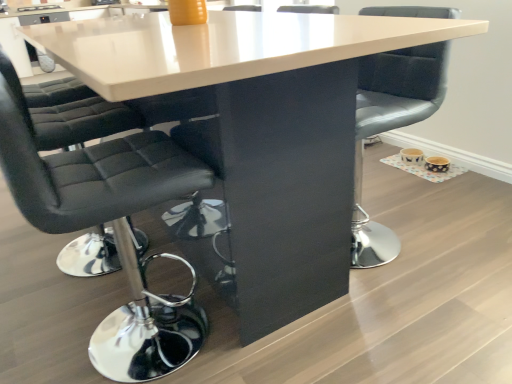
Question: In terms of size, does matte gray cushioned chair at center, which appears as the 1th chair when viewed from the right, appear bigger or smaller than black leather chair at left, positioned as the 2th chair in right-to-left order?

Choices:
 (A) big
 (B) small

Answer: (B)

Question: In the image, is matte gray cushioned chair at center, placed as the second chair when sorted from left to right, positioned in front of or behind black leather chair at left, positioned as the 2th chair in right-to-left order?

Choices:
 (A) behind
 (B) front

Answer: (A)

Question: Based on their positions, is matte gray cushioned chair at center, which appears as the 1th chair when viewed from the right, located to the left or right of black leather chair at left, positioned as the 2th chair in right-to-left order?

Choices:
 (A) right
 (B) left

Answer: (A)

Question: Considering their positions, is black leather chair at left, the first chair when ordered from left to right, located in front of or behind matte gray cushioned chair at center, which appears as the 1th chair when viewed from the right?

Choices:
 (A) behind
 (B) front

Answer: (B)

Question: Considering the positions of black leather chair at left, the first chair when ordered from left to right, and matte gray cushioned chair at center, placed as the second chair when sorted from left to right, in the image, is black leather chair at left, the first chair when ordered from left to right, taller or shorter than matte gray cushioned chair at center, placed as the second chair when sorted from left to right,?

Choices:
 (A) short
 (B) tall

Answer: (B)

Question: From a real-world perspective, relative to matte gray cushioned chair at center, which appears as the 1th chair when viewed from the right, is black leather chair at left, positioned as the 2th chair in right-to-left order, vertically above or below?

Choices:
 (A) below
 (B) above

Answer: (B)

Question: From the image's perspective, is black leather chair at left, the first chair when ordered from left to right, located above or below matte gray cushioned chair at center, which appears as the 1th chair when viewed from the right?

Choices:
 (A) above
 (B) below

Answer: (B)